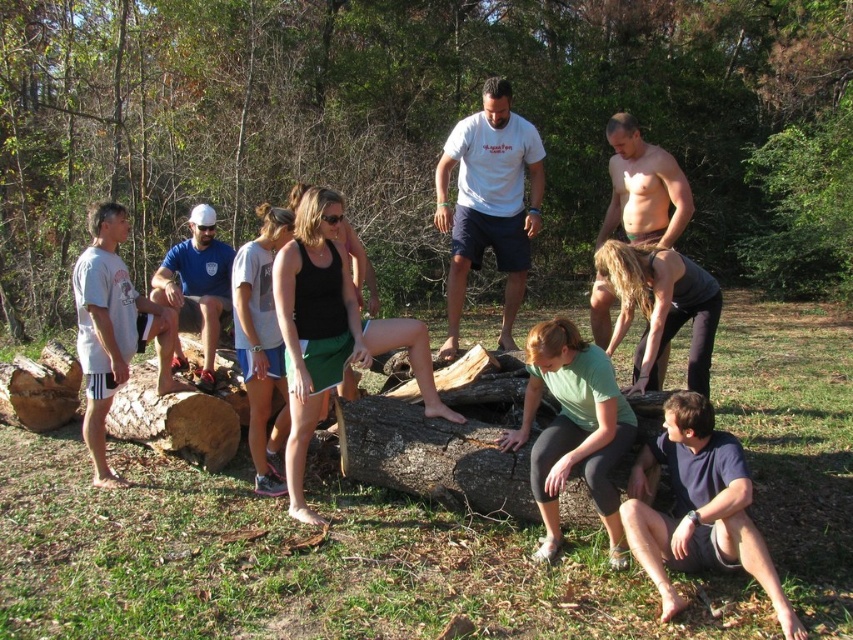
You are a photographer positioned at the edge of the forest scene. You want to take a photo that includes both the green matte shirt at lower center and the shiny skin at center. Which object should you adjust your focus to first to ensure both are in the frame?

The green matte shirt at lower center is closer to the viewer than the shiny skin at center, so you should focus on the green matte shirt at lower center first to ensure both are in the frame.

What is located at the coordinates point (663, 305) in the image?

The coordinates point (663, 305) in the image correspond to the location of the dark brown leggings at center.